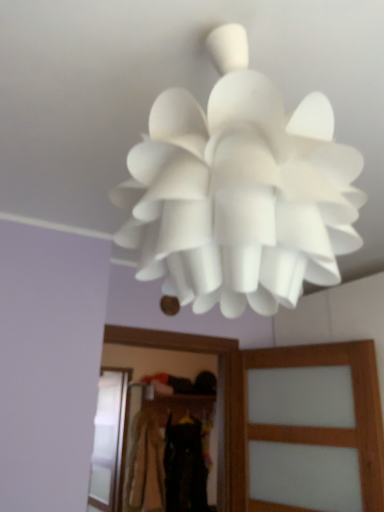
The width and height of the screenshot is (384, 512). Describe the element at coordinates (309, 429) in the screenshot. I see `translucent wood screen door at center, which ranks as the first screen door in right-to-left order` at that location.

At what (x,y) coordinates should I click in order to perform the action: click on black fabric at center, which is the second clothing from front to back. Please return your answer as a coordinate pair (x, y). Image resolution: width=384 pixels, height=512 pixels. Looking at the image, I should click on (185, 467).

Identify the location of dark brown fabric at center, the third clothing in the back-to-front sequence. (279, 425).

What is the approximate width of light brown fabric at center, which is the 3th clothing from front to back?

4.76 inches.

Find the location of a particular element. This screenshot has width=384, height=512. translucent wood screen door at center, which is the 2th screen door in left-to-right order is located at coordinates (309, 429).

Is dark brown fabric at center, the third clothing in the back-to-front sequence, outside of transparent glass screen door at lower left, the first screen door positioned from the back?

That's correct, dark brown fabric at center, the third clothing in the back-to-front sequence, is outside of transparent glass screen door at lower left, the first screen door positioned from the back.

Is point (254, 354) closer or farther from the camera than point (93, 470)?

Point (254, 354).

From the picture: How different are the orientations of dark brown fabric at center, the third clothing in the back-to-front sequence, and transparent glass screen door at lower left, which ranks as the first screen door in left-to-right order, in degrees?

There is a 0.311-degree angle between the facing directions of dark brown fabric at center, the third clothing in the back-to-front sequence, and transparent glass screen door at lower left, which ranks as the first screen door in left-to-right order.

Is dark brown fabric at center, the third clothing in the back-to-front sequence, to the left of transparent glass screen door at lower left, acting as the second screen door starting from the right, from the viewer's perspective?

Incorrect, dark brown fabric at center, the third clothing in the back-to-front sequence, is not on the left side of transparent glass screen door at lower left, acting as the second screen door starting from the right.

From the image's perspective, would you say light brown fabric at center, which is the 3th clothing from front to back, is shown under white matte lampshade at center?

Yes, from the image's perspective, light brown fabric at center, which is the 3th clothing from front to back, is below white matte lampshade at center.

Is light brown fabric at center, which is the 3th clothing from front to back, in front of or behind white matte lampshade at center in the image?

light brown fabric at center, which is the 3th clothing from front to back, is positioned farther from the viewer than white matte lampshade at center.

Is light brown fabric at center, which is the 3th clothing from front to back, turned away from white matte lampshade at center?

No, light brown fabric at center, which is the 3th clothing from front to back, is not facing the opposite direction of white matte lampshade at center.

From the picture: Can you confirm if light brown fabric at center, which is the 3th clothing from front to back, is positioned to the left of white matte lampshade at center?

Yes.

At what (x,y) coordinates should I click in order to perform the action: click on lamp located above the black fabric at center, which is the second clothing from front to back (from the image's perspective). Please return your answer as a coordinate pair (x, y). The height and width of the screenshot is (512, 384). Looking at the image, I should click on (239, 192).

Which of these two, white matte lampshade at center or black fabric at center, which is the second clothing from front to back, is wider?

With larger width is white matte lampshade at center.

Considering the relative positions of white matte lampshade at center and black fabric at center, which is the second clothing from front to back, in the image provided, is white matte lampshade at center behind black fabric at center, which is the second clothing from front to back,?

No, it is not.

Consider the image. From a real-world perspective, between black fabric at center, which is the second clothing from front to back, and white matte lampshade at center, who is vertically higher?

From a 3D spatial view, white matte lampshade at center is above.

Is black fabric at center, which appears as the second clothing when viewed from the back, facing away from white matte lampshade at center?

No, black fabric at center, which appears as the second clothing when viewed from the back, is not facing the opposite direction of white matte lampshade at center.

Find the location of a particular element. clothing that is the 1st one when counting leftward from the white matte lampshade at center is located at coordinates (185, 467).

Can you confirm if black fabric at center, which appears as the second clothing when viewed from the back, is shorter than dark brown fabric at center, acting as the 1th clothing starting from the front?

Indeed, black fabric at center, which appears as the second clothing when viewed from the back, has a lesser height compared to dark brown fabric at center, acting as the 1th clothing starting from the front.

Considering their positions, is black fabric at center, which appears as the second clothing when viewed from the back, located in front of or behind dark brown fabric at center, acting as the 1th clothing starting from the front?

In the image, black fabric at center, which appears as the second clothing when viewed from the back, appears behind dark brown fabric at center, acting as the 1th clothing starting from the front.

In the scene shown: Considering the relative sizes of black fabric at center, which appears as the second clothing when viewed from the back, and dark brown fabric at center, the third clothing in the back-to-front sequence, in the image provided, is black fabric at center, which appears as the second clothing when viewed from the back, smaller than dark brown fabric at center, the third clothing in the back-to-front sequence,?

Correct, black fabric at center, which appears as the second clothing when viewed from the back, occupies less space than dark brown fabric at center, the third clothing in the back-to-front sequence.

From a real-world perspective, is black fabric at center, which is the second clothing from front to back, under dark brown fabric at center, the third clothing in the back-to-front sequence?

Yes, from a real-world perspective, black fabric at center, which is the second clothing from front to back, is below dark brown fabric at center, the third clothing in the back-to-front sequence.

Looking at this image, from the image's perspective, is dark brown fabric at center, acting as the 1th clothing starting from the front, over black fabric at center, which is the second clothing from front to back?

Yes, from the image's perspective, dark brown fabric at center, acting as the 1th clothing starting from the front, is over black fabric at center, which is the second clothing from front to back.

Can you tell me how much dark brown fabric at center, the third clothing in the back-to-front sequence, and black fabric at center, which is the second clothing from front to back, differ in facing direction?

The facing directions of dark brown fabric at center, the third clothing in the back-to-front sequence, and black fabric at center, which is the second clothing from front to back, are 0.311 degrees apart.

Does dark brown fabric at center, the third clothing in the back-to-front sequence, have a greater height compared to black fabric at center, which appears as the second clothing when viewed from the back?

Indeed, dark brown fabric at center, the third clothing in the back-to-front sequence, has a greater height compared to black fabric at center, which appears as the second clothing when viewed from the back.

Is point (252, 355) closer to viewer compared to point (188, 467)?

Yes, it is in front of point (188, 467).

From the picture: What's the angular difference between black fabric at center, which appears as the second clothing when viewed from the back, and transparent glass screen door at lower left, the first screen door positioned from the back,'s facing directions?

0.00263 degrees separate the facing orientations of black fabric at center, which appears as the second clothing when viewed from the back, and transparent glass screen door at lower left, the first screen door positioned from the back.

Between black fabric at center, which appears as the second clothing when viewed from the back, and transparent glass screen door at lower left, acting as the second screen door starting from the right, which one appears on the right side from the viewer's perspective?

black fabric at center, which appears as the second clothing when viewed from the back, is more to the right.

Considering the sizes of objects black fabric at center, which appears as the second clothing when viewed from the back, and transparent glass screen door at lower left, acting as the second screen door starting from the right, in the image provided, who is wider, black fabric at center, which appears as the second clothing when viewed from the back, or transparent glass screen door at lower left, acting as the second screen door starting from the right,?

black fabric at center, which appears as the second clothing when viewed from the back.

Find the location of `the 3rd clothing counting from the right side of the transparent glass screen door at lower left, acting as the second screen door starting from the right`. the 3rd clothing counting from the right side of the transparent glass screen door at lower left, acting as the second screen door starting from the right is located at coordinates (185, 467).

The image size is (384, 512). Find the location of `the 2nd clothing counting from the right of the transparent glass screen door at lower left, acting as the second screen door starting from the right`. the 2nd clothing counting from the right of the transparent glass screen door at lower left, acting as the second screen door starting from the right is located at coordinates (279, 425).

Where is `the 3rd clothing behind when counting from the white matte lampshade at center`? the 3rd clothing behind when counting from the white matte lampshade at center is located at coordinates coord(145,466).

Considering their positions, is dark brown fabric at center, the third clothing in the back-to-front sequence, positioned further to white matte lampshade at center than transparent glass screen door at lower left, which is the second screen door from front to back?

Among the two, transparent glass screen door at lower left, which is the second screen door from front to back, is located further to white matte lampshade at center.

Based on their spatial positions, is light brown fabric at center, which is the 3th clothing from front to back, or transparent glass screen door at lower left, the first screen door positioned from the back, closer to translucent wood screen door at center, which is the 2th screen door in left-to-right order?

Among the two, light brown fabric at center, which is the 3th clothing from front to back, is located nearer to translucent wood screen door at center, which is the 2th screen door in left-to-right order.

From the image, which object appears to be farther from light brown fabric at center, arranged as the first clothing when viewed from the back, dark brown fabric at center, the third clothing in the back-to-front sequence, or transparent glass screen door at lower left, which ranks as the first screen door in left-to-right order?

dark brown fabric at center, the third clothing in the back-to-front sequence, is further to light brown fabric at center, arranged as the first clothing when viewed from the back.

Estimate the real-world distances between objects in this image. Which object is closer to transparent glass screen door at lower left, the first screen door positioned from the back, black fabric at center, which is the second clothing from front to back, or white matte lampshade at center?

Among the two, black fabric at center, which is the second clothing from front to back, is located nearer to transparent glass screen door at lower left, the first screen door positioned from the back.

From the image, which object appears to be nearer to transparent glass screen door at lower left, the first screen door positioned from the back, black fabric at center, which is the second clothing from front to back, or translucent wood screen door at center, which is the 2th screen door in left-to-right order?

black fabric at center, which is the second clothing from front to back, is closer to transparent glass screen door at lower left, the first screen door positioned from the back.

From the picture: Considering their positions, is translucent wood screen door at center, which is the 2th screen door in left-to-right order, positioned closer to dark brown fabric at center, acting as the 1th clothing starting from the front, than black fabric at center, which is the second clothing from front to back?

Based on the image, translucent wood screen door at center, which is the 2th screen door in left-to-right order, appears to be nearer to dark brown fabric at center, acting as the 1th clothing starting from the front.

Estimate the real-world distances between objects in this image. Which object is closer to light brown fabric at center, arranged as the first clothing when viewed from the back, transparent glass screen door at lower left, acting as the second screen door starting from the right, or translucent wood screen door at center, which ranks as the first screen door in right-to-left order?

The object closer to light brown fabric at center, arranged as the first clothing when viewed from the back, is transparent glass screen door at lower left, acting as the second screen door starting from the right.

Looking at the image, which one is located closer to light brown fabric at center, arranged as the first clothing when viewed from the back, translucent wood screen door at center, positioned as the first screen door in front-to-back order, or black fabric at center, which is the second clothing from front to back?

black fabric at center, which is the second clothing from front to back.

Identify the location of clothing between dark brown fabric at center, acting as the 1th clothing starting from the front, and light brown fabric at center, arranged as the first clothing when viewed from the back, in the front-back direction. click(x=185, y=467).

Where is `clothing between translucent wood screen door at center, positioned as the first screen door in front-to-back order, and black fabric at center, which is the second clothing from front to back, in the front-back direction`? The height and width of the screenshot is (512, 384). clothing between translucent wood screen door at center, positioned as the first screen door in front-to-back order, and black fabric at center, which is the second clothing from front to back, in the front-back direction is located at coordinates (279, 425).

Locate an element on the screen. The height and width of the screenshot is (512, 384). screen door between dark brown fabric at center, the third clothing in the back-to-front sequence, and black fabric at center, which appears as the second clothing when viewed from the back, along the z-axis is located at coordinates (109, 439).

Find the location of a particular element. screen door between white matte lampshade at center and dark brown fabric at center, acting as the 1th clothing starting from the front, from front to back is located at coordinates (309, 429).